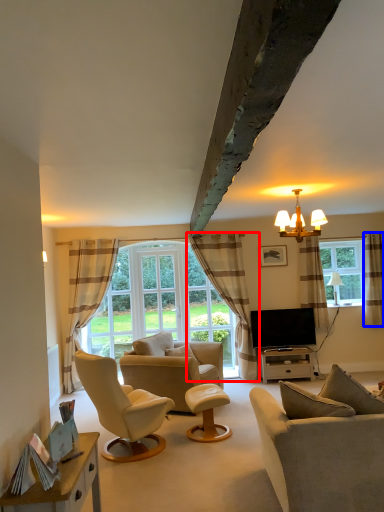
Question: Which object is further to the camera taking this photo, curtain (highlighted by a red box) or curtain (highlighted by a blue box)?

Choices:
 (A) curtain
 (B) curtain

Answer: (B)